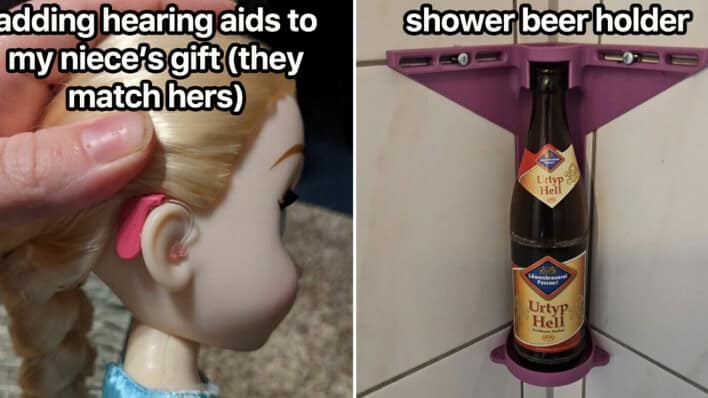
The height and width of the screenshot is (398, 708). I want to click on beer bottle, so click(x=568, y=223).